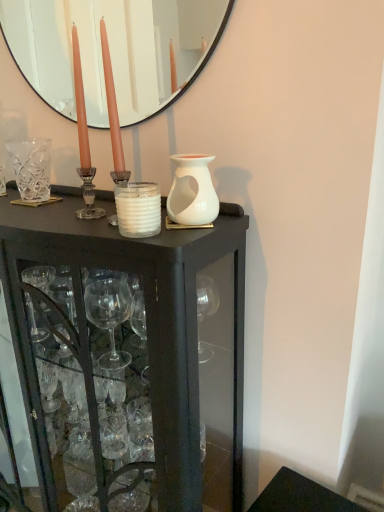
Question: Is black glass cabinet at center taller than clear crystal vase at left?

Choices:
 (A) yes
 (B) no

Answer: (A)

Question: Could you tell me if black glass cabinet at center is facing clear crystal vase at left?

Choices:
 (A) yes
 (B) no

Answer: (B)

Question: Is black glass cabinet at center smaller than clear crystal vase at left?

Choices:
 (A) yes
 (B) no

Answer: (B)

Question: Considering the relative sizes of black glass cabinet at center and clear crystal vase at left in the image provided, is black glass cabinet at center thinner than clear crystal vase at left?

Choices:
 (A) no
 (B) yes

Answer: (A)

Question: Considering the relative positions of black glass cabinet at center and clear crystal vase at left in the image provided, is black glass cabinet at center to the right of clear crystal vase at left from the viewer's perspective?

Choices:
 (A) yes
 (B) no

Answer: (A)

Question: From a real-world perspective, is black glass cabinet at center located higher than clear crystal vase at left?

Choices:
 (A) no
 (B) yes

Answer: (A)

Question: Is white matte candle at center to the right of white matte vase at center from the viewer's perspective?

Choices:
 (A) yes
 (B) no

Answer: (B)

Question: From the image's perspective, is white matte candle at center below white matte vase at center?

Choices:
 (A) yes
 (B) no

Answer: (A)

Question: Does white matte candle at center have a smaller size compared to white matte vase at center?

Choices:
 (A) no
 (B) yes

Answer: (B)

Question: Does white matte candle at center have a greater width compared to white matte vase at center?

Choices:
 (A) no
 (B) yes

Answer: (A)

Question: Can you confirm if white matte candle at center is shorter than white matte vase at center?

Choices:
 (A) no
 (B) yes

Answer: (B)

Question: Could white matte vase at center be considered to be inside white matte candle at center?

Choices:
 (A) yes
 (B) no

Answer: (B)

Question: Would you say black glass cabinet at center contains white matte vase at center?

Choices:
 (A) no
 (B) yes

Answer: (A)